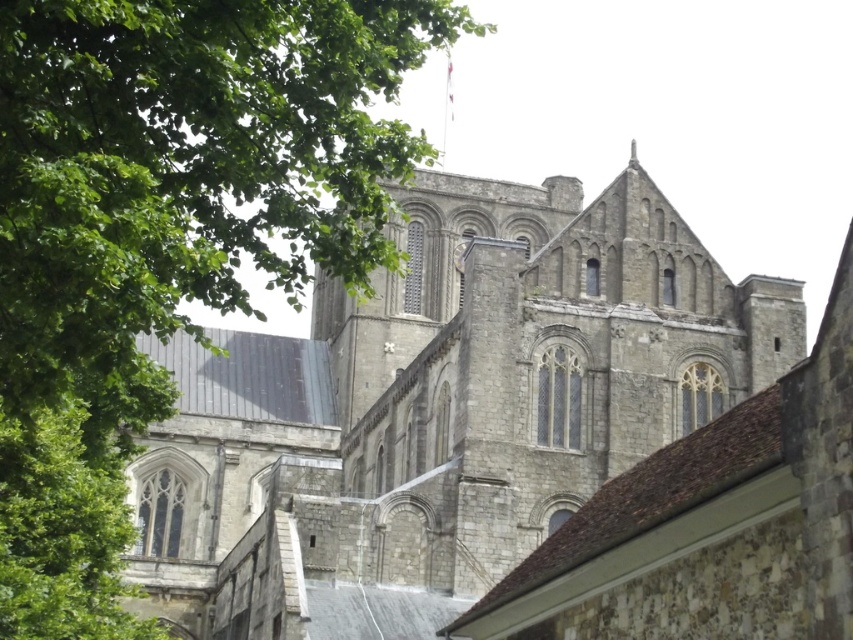
Question: Which point appears farthest from the camera in this image?

Choices:
 (A) (663, 196)
 (B) (100, 636)
 (C) (74, 499)

Answer: (A)

Question: Is stone church at center above green leafy tree at left?

Choices:
 (A) no
 (B) yes

Answer: (B)

Question: Which of the following is the farthest from the observer?

Choices:
 (A) (379, 148)
 (B) (398, 548)
 (C) (96, 534)

Answer: (B)

Question: Can you confirm if stone church at center is positioned below green leafy tree at upper left?

Choices:
 (A) no
 (B) yes

Answer: (B)

Question: Based on their relative distances, which object is farther from the stone church at center?

Choices:
 (A) green leafy tree at upper left
 (B) green leafy tree at left

Answer: (B)

Question: Does green leafy tree at upper left come in front of green leafy tree at left?

Choices:
 (A) yes
 (B) no

Answer: (A)